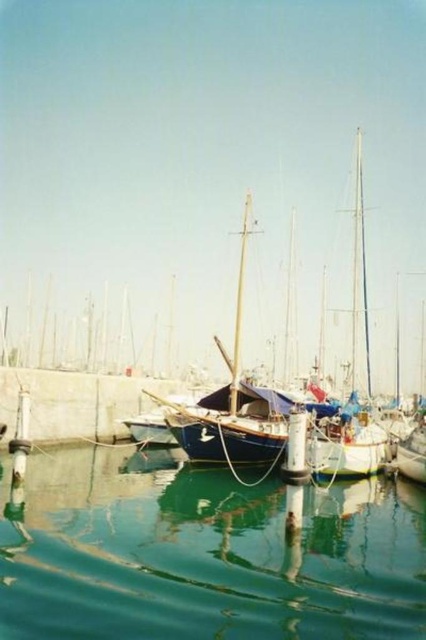
You are a boat operator who needs to navigate a new boat into the marina. The boat requires a minimum of 30 meters of space to maneuver safely. Based on the scene, is there enough space between the green reflective water at center and the blue canvas sailboat at center to safely maneuver your boat?

The distance between the green reflective water at center and the blue canvas sailboat at center is 32.13 meters, which exceeds the required 30 meters. Therefore, there is sufficient space to safely maneuver the boat.

You are standing on the marina jetty and see the green reflective water at center and the blue canvas sailboat at center. Which object is positioned to the left of the other?

The green reflective water at center is to the left of the blue canvas sailboat at center.